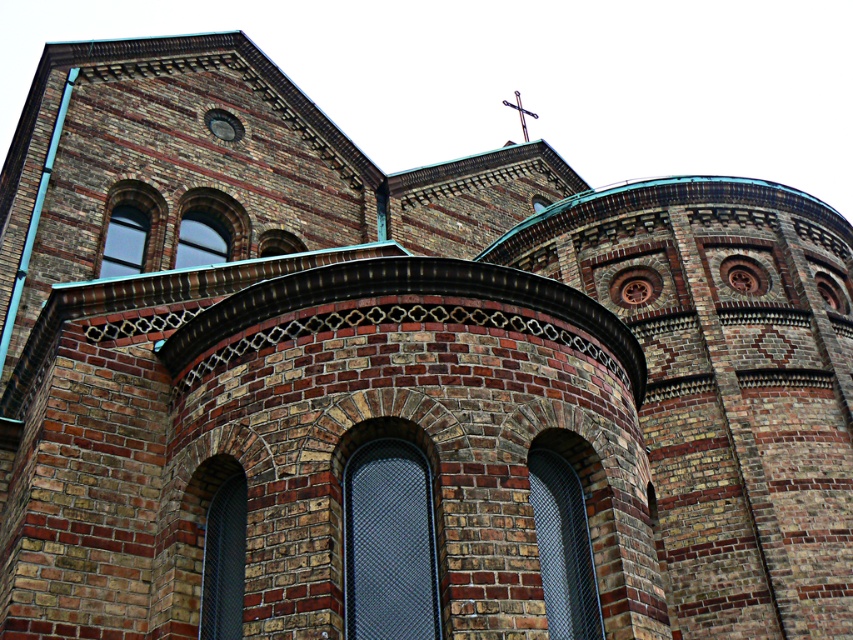
You are an architect designing a new building and want to ensure proper spacing between the metallic mesh window at center and the metallic cross at upper center. Given that the cross is 10 feet tall, what is the minimum distance in feet you should maintain between them to avoid visual clutter?

The metallic mesh window at center is 788.70 feet from the metallic cross at upper center. Since the cross is only 10 feet tall, maintaining a distance of 788.70 feet ensures there is sufficient space to prevent visual clutter between them.